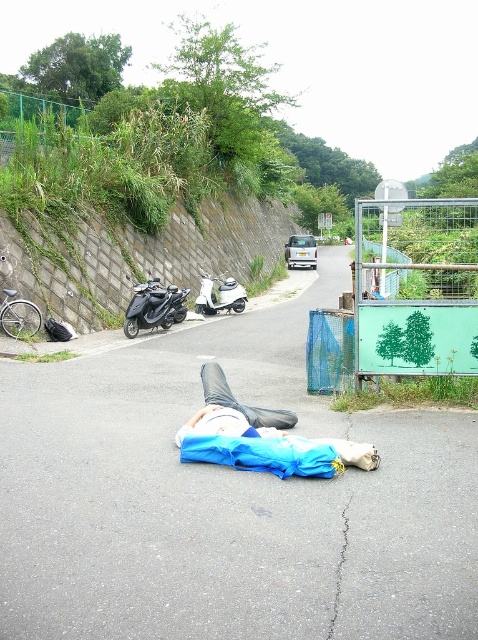
Question: Does blue fabric at center have a smaller size compared to white glossy scooter at center?

Choices:
 (A) yes
 (B) no

Answer: (A)

Question: Which of the following is the farthest from the observer?

Choices:
 (A) white glossy scooter at center
 (B) shiny black scooter at left
 (C) blue fabric at center

Answer: (A)

Question: Which is nearer to the blue fabric at center?

Choices:
 (A) shiny black scooter at left
 (B) white glossy scooter at center

Answer: (A)

Question: Which point is closer to the camera?

Choices:
 (A) shiny black scooter at left
 (B) white glossy scooter at center
 (C) blue fabric at center

Answer: (C)

Question: Is blue fabric at center to the right of white glossy scooter at center from the viewer's perspective?

Choices:
 (A) yes
 (B) no

Answer: (A)

Question: Is shiny black scooter at left smaller than white glossy scooter at center?

Choices:
 (A) yes
 (B) no

Answer: (B)